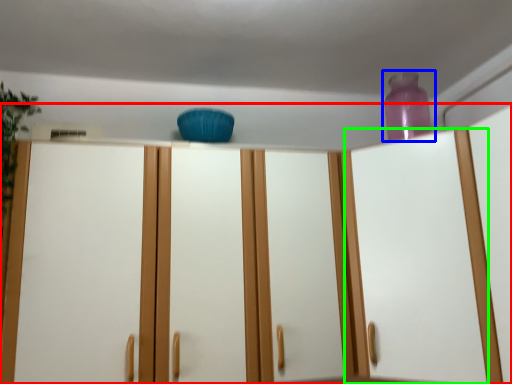
Question: Estimate the real-world distances between objects in this image. Which object is farther from cupboard (highlighted by a red box), bottle (highlighted by a blue box) or glass door (highlighted by a green box)?

Choices:
 (A) bottle
 (B) glass door

Answer: (A)